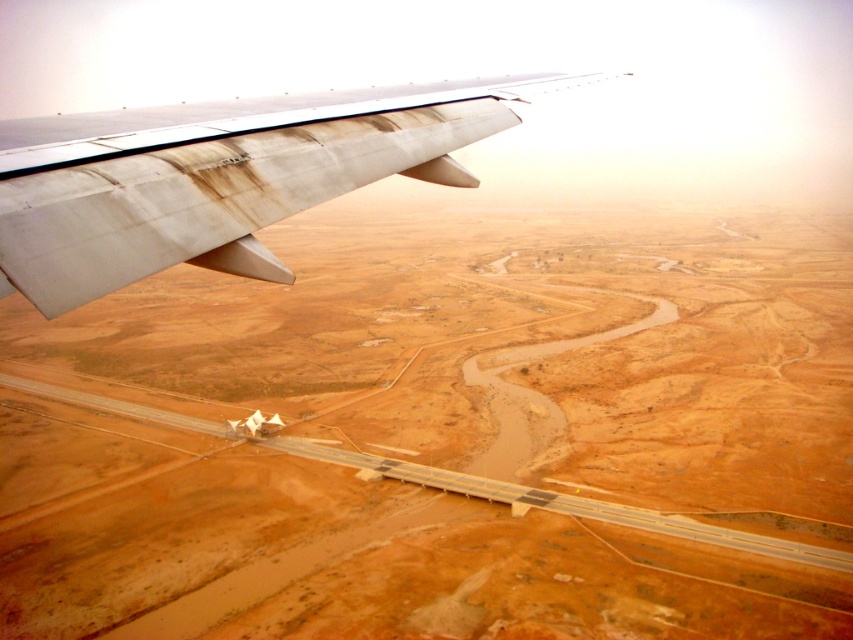
You are a pilot observing the desert sand at upper left and the rusty aluminum wing at upper left from the cockpit. Which object appears wider when viewed from this perspective?

The desert sand at upper left might be wider than the rusty aluminum wing at upper left according to the description.